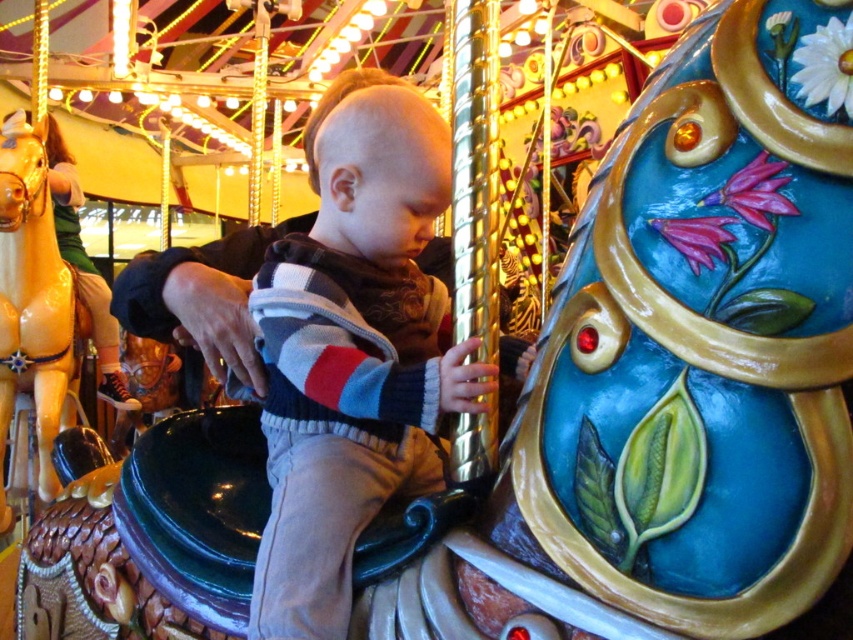
Does striped sweater at center lie behind shiny gold horse at left?

No, it is not.

Does striped sweater at center have a larger size compared to shiny gold horse at left?

Correct, striped sweater at center is larger in size than shiny gold horse at left.

In the scene shown: Who is more distant from viewer, (349, 388) or (57, 362)?

The point (57, 362) is behind.

What are the coordinates of `striped sweater at center` in the screenshot? It's located at (352, 349).